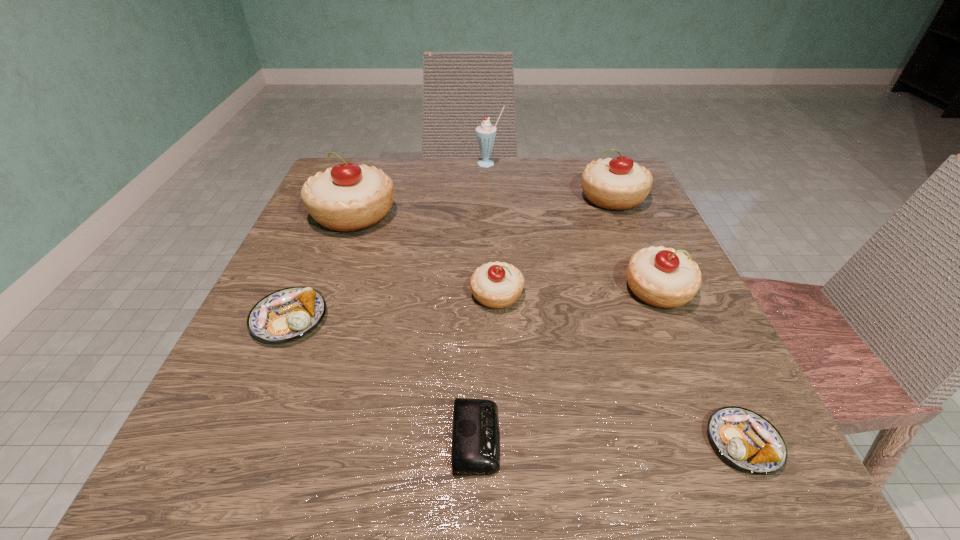
Where is `vacant space located 0.200m on the back of the left brown pastry`? The height and width of the screenshot is (540, 960). vacant space located 0.200m on the back of the left brown pastry is located at coordinates (330, 225).

Find the location of a particular element. vacant space situated on the left of the nearest pastry is located at coordinates (477, 443).

Where is `free location located 0.130m on the display of the shortest object`? The width and height of the screenshot is (960, 540). free location located 0.130m on the display of the shortest object is located at coordinates (602, 438).

This screenshot has height=540, width=960. Identify the location of milkshake positioned at the far edge. (485, 133).

Identify the location of pastry located at the near edge. This screenshot has width=960, height=540. (747, 440).

Identify the location of alarm clock positioned at the near edge. (475, 451).

Find the location of a particular element. The height and width of the screenshot is (540, 960). object at the far left corner is located at coordinates (348, 197).

Locate an element on the screen. object located in the far right corner section of the desktop is located at coordinates point(619,183).

This screenshot has height=540, width=960. Find the location of `object that is at the near right corner`. object that is at the near right corner is located at coordinates (747, 440).

Find the location of a particular element. This screenshot has height=540, width=960. vacant space at the far edge of the desktop is located at coordinates (571, 206).